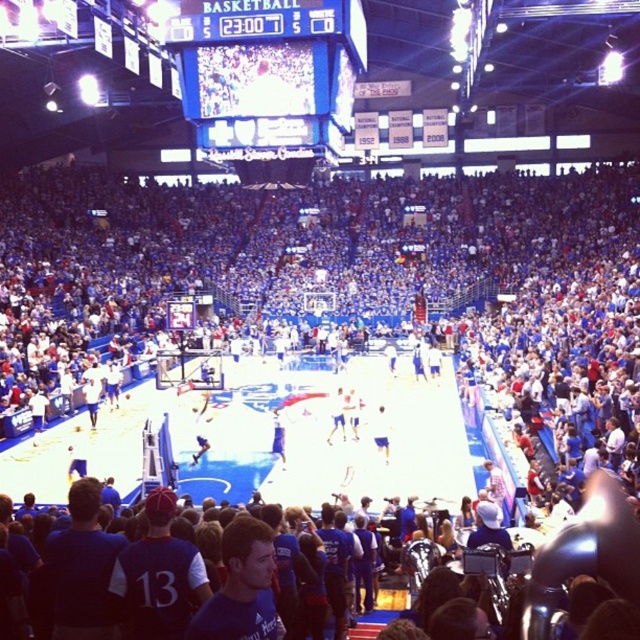
Does blue fabric shorts at center come behind white jersey at center?

No, blue fabric shorts at center is closer to the viewer.

Is blue fabric shorts at center closer to the viewer compared to white jersey at center?

Yes.

At what (x,y) coordinates should I click in order to perform the action: click on blue fabric shorts at center. Please return your answer as a coordinate pair (x, y). Looking at the image, I should click on (381, 433).

At what (x,y) coordinates should I click in order to perform the action: click on white jersey at center. Please return your answer as a coordinate pair (x, y). The height and width of the screenshot is (640, 640). Looking at the image, I should click on (337, 416).

Consider the image. Can you confirm if white jersey at center is positioned below blue jersey at center?

Yes.

Does point (342, 410) come behind point (83, 388)?

No, (342, 410) is closer to viewer.

Locate an element on the screen. This screenshot has width=640, height=640. white jersey at center is located at coordinates (337, 416).

Looking at this image, measure the distance between blue glossy scoreboard at upper center and blue jersey at center.

They are 36.04 meters apart.

Between blue glossy scoreboard at upper center and blue jersey at center, which one has less height?

Standing shorter between the two is blue jersey at center.

Where is `blue glossy scoreboard at upper center`? This screenshot has height=640, width=640. blue glossy scoreboard at upper center is located at coordinates (268, 81).